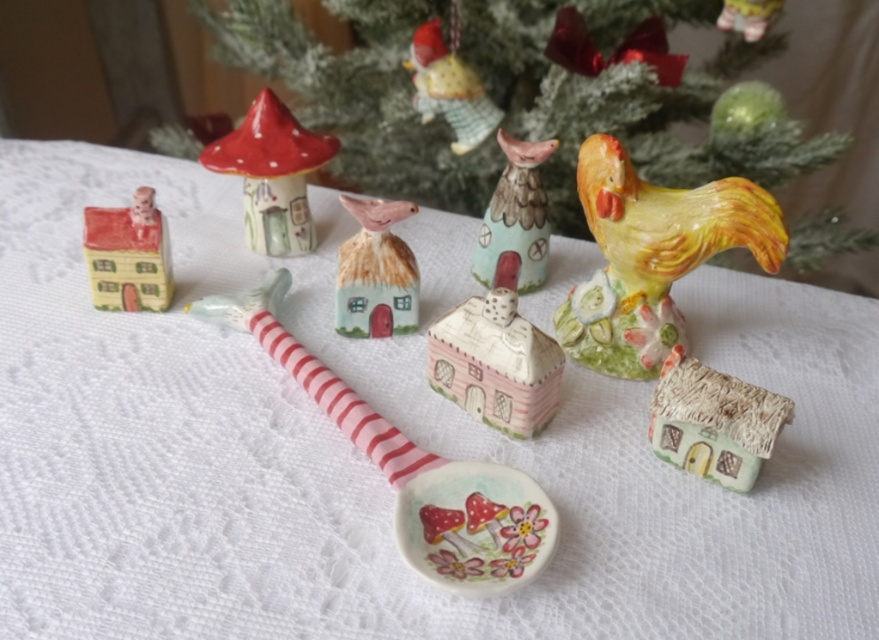
Question: Which of the following is the farthest from the observer?

Choices:
 (A) (121, 259)
 (B) (386, 310)
 (C) (314, 132)
 (D) (752, 419)

Answer: (C)

Question: Can you confirm if matte ceramic mushroom at center is bigger than porcelain birdhouse at center?

Choices:
 (A) yes
 (B) no

Answer: (A)

Question: Is yellow glossy ceramic rooster at upper right to the right of porcelain birdhouse at center from the viewer's perspective?

Choices:
 (A) no
 (B) yes

Answer: (B)

Question: Which point is farther to the camera?

Choices:
 (A) (474, 106)
 (B) (390, 140)
 (C) (527, 420)

Answer: (B)

Question: Considering the real-world distances, which object is farthest from the matte ceramic mushroom at center?

Choices:
 (A) pink matte house at center
 (B) yellow glossy ceramic rooster at upper right
 (C) matte green house at lower right

Answer: (C)

Question: Is porcelain christmas tree at upper center positioned before porcelain birdhouse at center?

Choices:
 (A) no
 (B) yes

Answer: (A)